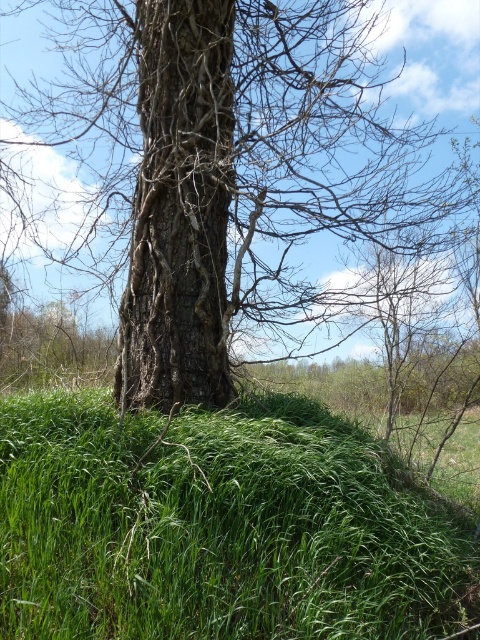
Question: Is green grassy mound at lower left closer to the viewer compared to brown rough bark tree trunk at center?

Choices:
 (A) yes
 (B) no

Answer: (A)

Question: Among these objects, which one is farthest from the camera?

Choices:
 (A) brown rough bark tree trunk at center
 (B) smooth bark tree at center
 (C) green grassy mound at lower left

Answer: (A)

Question: Which is nearer to the smooth bark tree at center?

Choices:
 (A) green grassy mound at lower left
 (B) brown rough bark tree trunk at center

Answer: (B)

Question: Which point appears closest to the camera in this image?

Choices:
 (A) (402, 157)
 (B) (136, 636)

Answer: (B)

Question: From the image, what is the correct spatial relationship of smooth bark tree at center in relation to green grassy mound at lower left?

Choices:
 (A) right
 (B) left

Answer: (A)

Question: Can you confirm if smooth bark tree at center is positioned above brown rough bark tree trunk at center?

Choices:
 (A) no
 (B) yes

Answer: (B)